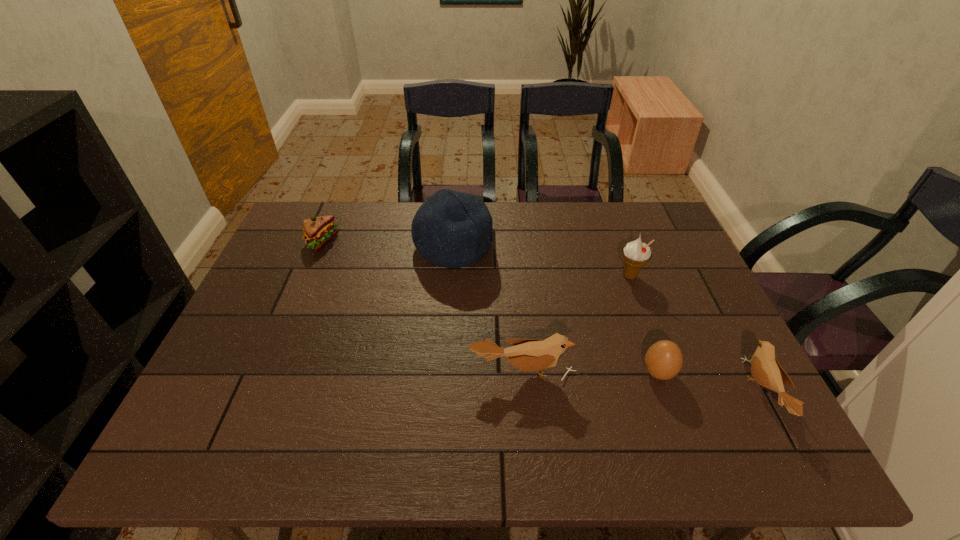
The image size is (960, 540). I want to click on blank region between the rightmost object and the skullcap, so click(608, 319).

This screenshot has width=960, height=540. Identify the location of free space between the shorter bird and the left bird. tap(642, 382).

Locate an element on the screen. The image size is (960, 540). vacant area that lies between the icecream and the skullcap is located at coordinates (541, 261).

Find the location of `free point between the rightmost object and the boiled egg`. free point between the rightmost object and the boiled egg is located at coordinates (710, 383).

Locate an element on the screen. free space between the leftmost object and the shorter bird is located at coordinates (541, 318).

Select which object is the fourth closest to the icecream. Please provide its 2D coordinates. Your answer should be formatted as a tuple, i.e. [(x, y)], where the tuple contains the x and y coordinates of a point satisfying the conditions above.

[(451, 229)]

Locate an element on the screen. The width and height of the screenshot is (960, 540). the second closest object to the icecream is located at coordinates (765, 368).

This screenshot has width=960, height=540. Identify the location of free space that satisfies the following two spatial constraints: 1. at the beak of the boiled egg; 2. on the left side of the left bird. point(523,373).

Identify the location of free space that satisfies the following two spatial constraints: 1. on the back side of the icecream; 2. on the left side of the boiled egg. (624, 276).

I want to click on vacant space that satisfies the following two spatial constraints: 1. on the front side of the sandwich; 2. on the left side of the icecream, so click(x=307, y=276).